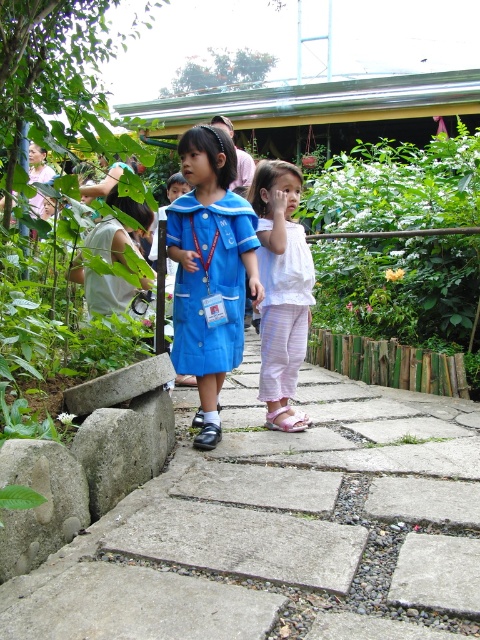
Between matte blue dress at center and white striped fabric dress at center, which one is positioned higher?

matte blue dress at center is above.

Locate an element on the screen. This screenshot has height=640, width=480. matte blue dress at center is located at coordinates click(210, 269).

Between point (226, 323) and point (269, 364), which one is positioned in front?

Point (226, 323) is more forward.

At what (x,y) coordinates should I click in order to perform the action: click on matte blue dress at center. Please return your answer as a coordinate pair (x, y). Image resolution: width=480 pixels, height=640 pixels. Looking at the image, I should click on (210, 269).

Who is lower down, white striped fabric dress at center or blue fabric dress at center?

white striped fabric dress at center

The width and height of the screenshot is (480, 640). Find the location of `white striped fabric dress at center`. white striped fabric dress at center is located at coordinates (284, 314).

The height and width of the screenshot is (640, 480). Find the location of `white striped fabric dress at center`. white striped fabric dress at center is located at coordinates (284, 314).

Can you confirm if concrete paving stones at center is shorter than white striped fabric dress at center?

Yes.

Which is more to the right, concrete paving stones at center or white striped fabric dress at center?

concrete paving stones at center is more to the right.

Find the location of a particular element. The image size is (480, 640). concrete paving stones at center is located at coordinates (283, 529).